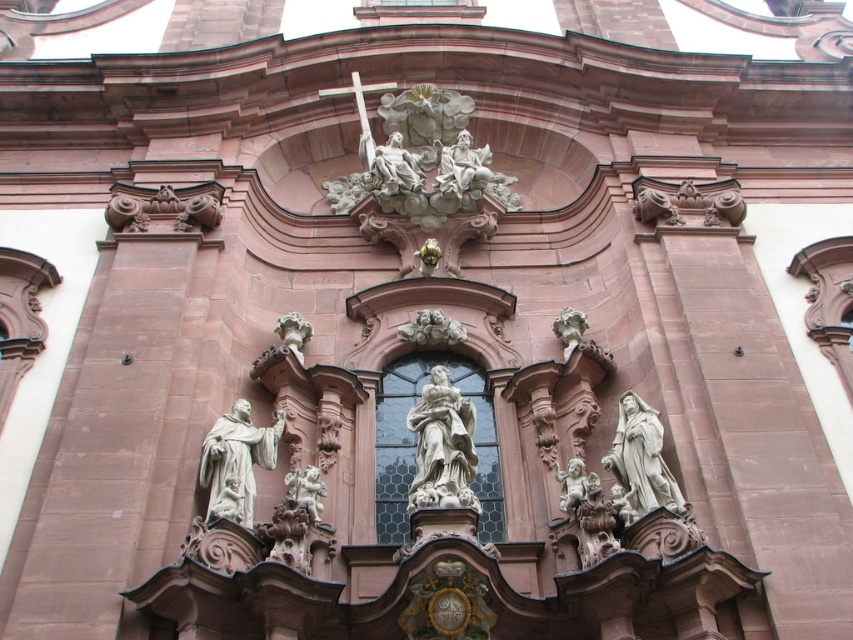
Does white marble statue at center appear under white stone statue at center?

No, white marble statue at center is not below white stone statue at center.

What do you see at coordinates (442, 445) in the screenshot? This screenshot has height=640, width=853. I see `white marble statue at center` at bounding box center [442, 445].

I want to click on white marble statue at center, so click(442, 445).

In the scene shown: Who is positioned more to the right, white stone sculpture at upper center or white marble statue at center?

white marble statue at center

Is point (386, 202) positioned before point (466, 442)?

No, (386, 202) is further to viewer.

Is point (451, 211) positioned after point (451, 461)?

Yes, point (451, 211) is farther from viewer.

Locate an element on the screen. The height and width of the screenshot is (640, 853). white stone sculpture at upper center is located at coordinates (418, 157).

Who is lower down, white stone sculpture at upper center or white stone statue at center?

Positioned lower is white stone statue at center.

Does white stone sculpture at upper center have a lesser height compared to white stone statue at center?

In fact, white stone sculpture at upper center may be taller than white stone statue at center.

Where is `white stone sculpture at upper center`? white stone sculpture at upper center is located at coordinates (418, 157).